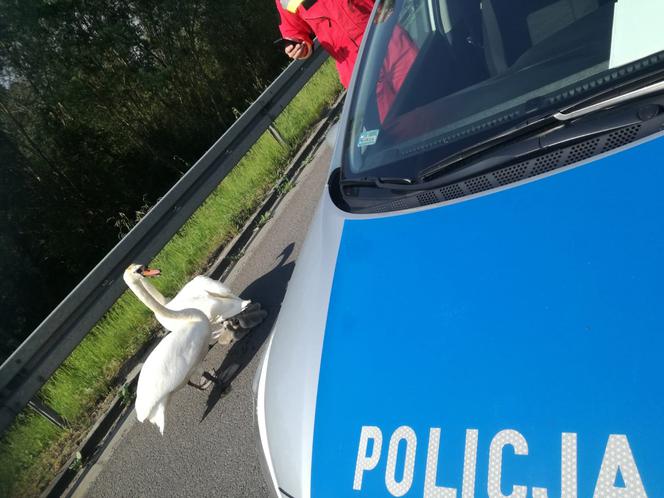
Locate an element on the screen. Image resolution: width=664 pixels, height=498 pixels. phone is located at coordinates (284, 39).